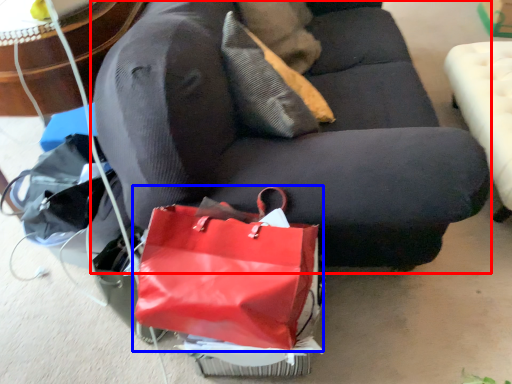
Question: Which of the following is the closest to the observer, studio couch (highlighted by a red box) or handbag (highlighted by a blue box)?

Choices:
 (A) studio couch
 (B) handbag

Answer: (A)